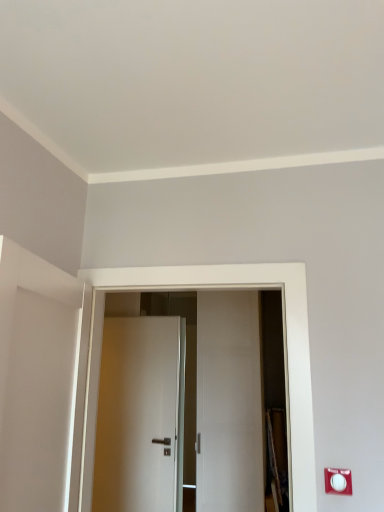
Question: Based on their sizes in the image, would you say white plastic electric outlet at lower right is bigger or smaller than white matte door at center, the second door viewed from the front?

Choices:
 (A) big
 (B) small

Answer: (B)

Question: Is white plastic electric outlet at lower right inside the boundaries of white matte door at center, which is the first door in back-to-front order, or outside?

Choices:
 (A) inside
 (B) outside

Answer: (B)

Question: Estimate the real-world distances between objects in this image. Which object is closer to the white matte door at center, which is the first door in back-to-front order?

Choices:
 (A) white glossy door at center, which is counted as the 2th door, starting from the back
 (B) white plastic electric outlet at lower right

Answer: (A)

Question: Estimate the real-world distances between objects in this image. Which object is farther from the white glossy door at center, which appears as the 1th door when viewed from the front?

Choices:
 (A) white matte door at center, which is the first door in back-to-front order
 (B) white plastic electric outlet at lower right

Answer: (A)